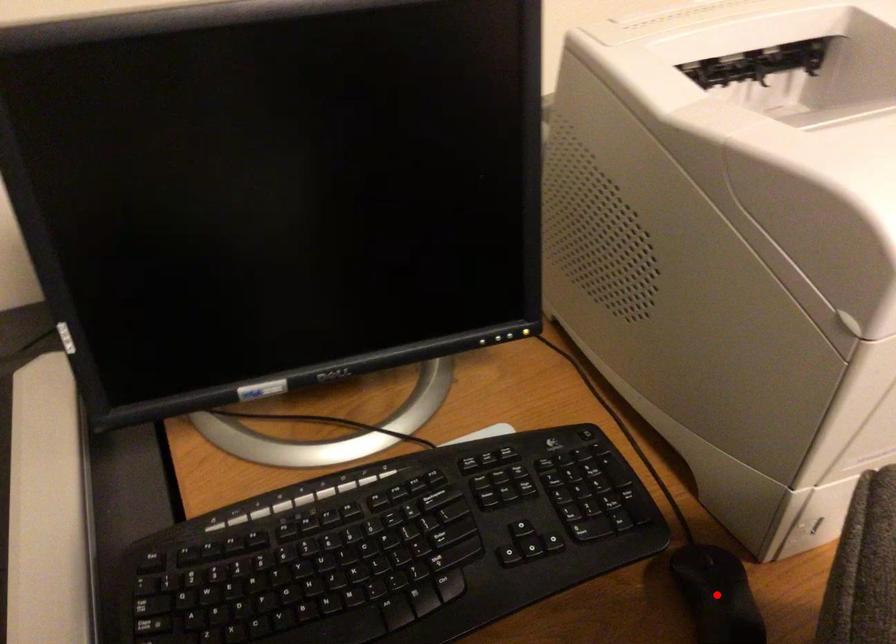
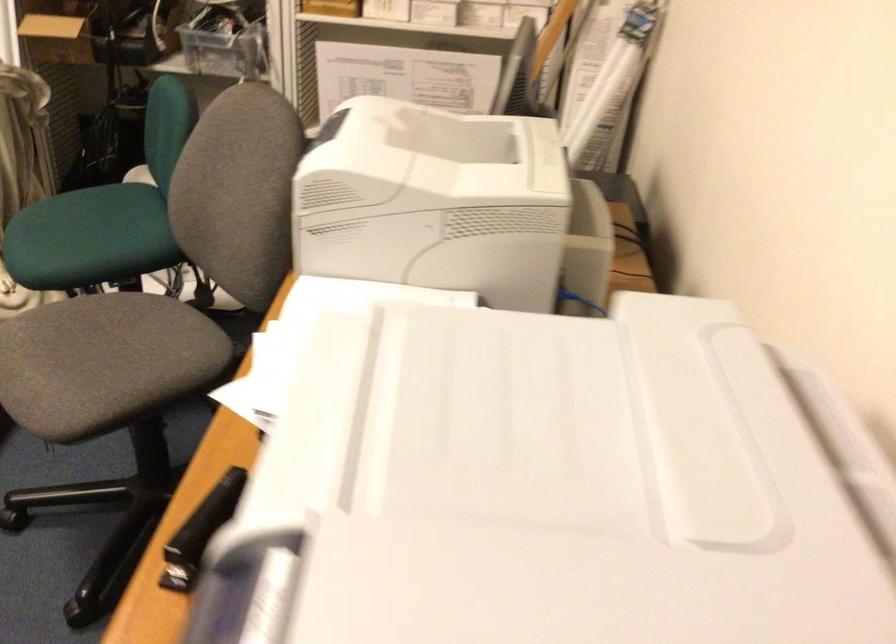
Question: I am providing you with two images of the same scene from different viewpoints. A red point is marked on the first image. Can you still see the location of the red point in image 2?

Choices:
 (A) Yes
 (B) No

Answer: (B)